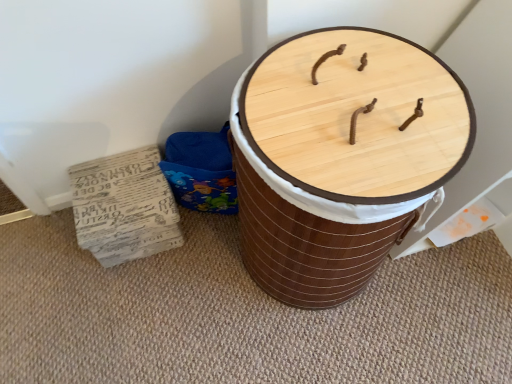
Where is `free space to the left of recycled paper stack at lower left`? free space to the left of recycled paper stack at lower left is located at coordinates (48, 252).